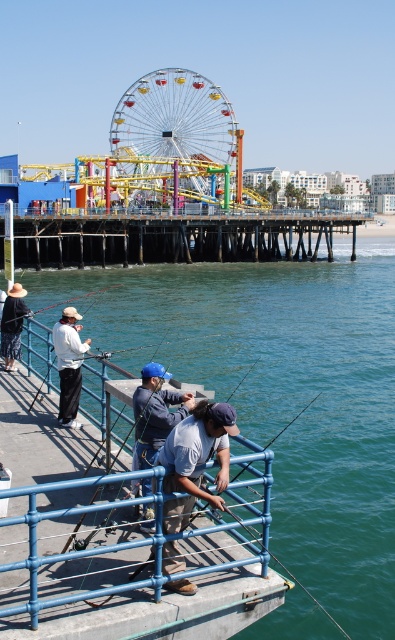
Looking at the pier scene, which object takes up more space in the image between the multicolored metallic ferris wheel at center and the white matte shirt at center?

The multicolored metallic ferris wheel at center is larger in size than the white matte shirt at center, so it takes up more space in the image.

In the scene shown: You are standing on the pier and want to take a photo of both the multicolored metallic ferris wheel at center and the white matte shirt at center. Which object should you position to the right side of your camera frame to include both in the photo?

To include both the multicolored metallic ferris wheel at center and the white matte shirt at center in your photo, you should position the white matte shirt at center to the right side of your camera frame since the multicolored metallic ferris wheel at center is to the left of it.

You are a photographer trying to capture a shot of the white matte shirt at center and the matte black fishing pole at lower left. Based on their positions, which object is closer to the camera?

The white matte shirt at center is located below the matte black fishing pole at lower left, meaning the matte black fishing pole at lower left is closer to the camera.